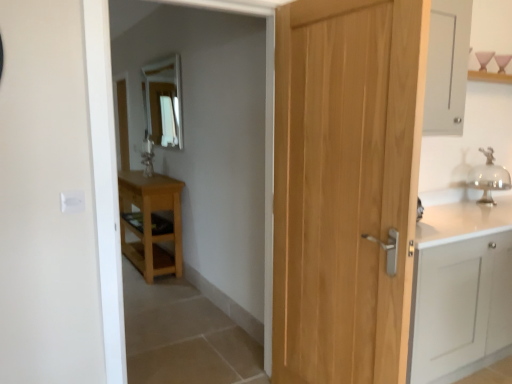
Locate an element on the screen. The height and width of the screenshot is (384, 512). clear glass mirror at upper center is located at coordinates (164, 102).

At what (x,y) coordinates should I click in order to perform the action: click on clear glass bell at right. Please return your answer as a coordinate pair (x, y). The image size is (512, 384). Looking at the image, I should click on (489, 177).

Image resolution: width=512 pixels, height=384 pixels. In order to click on clear glass mirror at upper center in this screenshot , I will do `click(164, 102)`.

You are a GUI agent. You are given a task and a screenshot of the screen. Output one action in this format:
    pyautogui.click(x=<x>, y=<y>)
    Task: Click on the faucet above the light brown wood door at center (from a real-world perspective)
    
    Given the screenshot: What is the action you would take?
    pyautogui.click(x=489, y=177)

Is light brown wood door at center inside clear glass bell at right?

Actually, light brown wood door at center is outside clear glass bell at right.

Consider the image. Is clear glass bell at right in contact with light brown wood door at center?

No, clear glass bell at right is not in contact with light brown wood door at center.

From a real-world perspective, is clear glass bell at right physically located above or below light brown wood door at center?

From a real-world perspective, clear glass bell at right is physically above light brown wood door at center.

Would you say clear glass mirror at upper center contains clear glass bell at right?

Definitely not — clear glass bell at right is not inside clear glass mirror at upper center.

From the image's perspective, which one is positioned higher, clear glass mirror at upper center or clear glass bell at right?

clear glass mirror at upper center, from the image's perspective.

At what (x,y) coordinates should I click in order to perform the action: click on mirror located above the clear glass bell at right (from a real-world perspective). Please return your answer as a coordinate pair (x, y). Looking at the image, I should click on (164, 102).

From the image's perspective, relative to light brown wood door at center, is light wood table at left above or below?

From the image's perspective, light wood table at left appears below light brown wood door at center.

Can you confirm if light wood table at left is thinner than light brown wood door at center?

In fact, light wood table at left might be wider than light brown wood door at center.

In the scene shown: Considering their positions, is light wood table at left located in front of or behind light brown wood door at center?

Visually, light wood table at left is located behind light brown wood door at center.

From a real-world perspective, which is physically above, light brown wood door at center or clear glass bell at right?

clear glass bell at right is physically above.

Does light brown wood door at center appear on the right side of clear glass bell at right?

Incorrect, light brown wood door at center is not on the right side of clear glass bell at right.

Is light brown wood door at center not within clear glass bell at right?

Indeed, light brown wood door at center is completely outside clear glass bell at right.

Does light brown wood door at center have a greater width compared to clear glass bell at right?

No.

From the image's perspective, is light wood table at left located above clear glass mirror at upper center?

No, from the image's perspective, light wood table at left is not over clear glass mirror at upper center.

From a real-world perspective, is light wood table at left beneath clear glass mirror at upper center?

Yes, from a real-world perspective, light wood table at left is beneath clear glass mirror at upper center.

Is point (159, 231) positioned behind point (164, 93)?

That is True.

Is light wood table at left situated inside clear glass bell at right or outside?

light wood table at left lies outside clear glass bell at right.

In the scene shown: Which is more to the left, light wood table at left or clear glass bell at right?

Positioned to the left is light wood table at left.

Is light wood table at left bigger than clear glass bell at right?

Indeed, light wood table at left has a larger size compared to clear glass bell at right.

Identify the location of table below the clear glass bell at right (from a real-world perspective). The height and width of the screenshot is (384, 512). (151, 222).

Could you tell me if light brown wood door at center is turned towards clear glass mirror at upper center?

No, light brown wood door at center is not facing towards clear glass mirror at upper center.

Identify the location of mirror above the light brown wood door at center (from a real-world perspective). (164, 102).

In the scene shown: Can you tell me how much light brown wood door at center and clear glass mirror at upper center differ in facing direction?

The angle between the facing direction of light brown wood door at center and the facing direction of clear glass mirror at upper center is 0.493 degrees.

Which is closer to the camera, [333,352] or [172,98]?

Point [333,352] is positioned closer to the camera compared to point [172,98].

At what (x,y) coordinates should I click in order to perform the action: click on door in front of the clear glass bell at right. Please return your answer as a coordinate pair (x, y). This screenshot has height=384, width=512. Looking at the image, I should click on (346, 187).

This screenshot has height=384, width=512. Identify the location of mirror above the clear glass bell at right (from a real-world perspective). (164, 102).

Considering their positions, is clear glass mirror at upper center positioned closer to light brown wood door at center than clear glass bell at right?

Based on the image, clear glass bell at right appears to be nearer to light brown wood door at center.

From the image, which object appears to be farther from clear glass mirror at upper center, light brown wood door at center or light wood table at left?

light brown wood door at center lies further to clear glass mirror at upper center than the other object.

When comparing their distances from light wood table at left, does light brown wood door at center or clear glass bell at right seem closer?

Among the two, light brown wood door at center is located nearer to light wood table at left.

Which object lies nearer to the anchor point clear glass bell at right, light wood table at left or light brown wood door at center?

light brown wood door at center.

Considering their positions, is light wood table at left positioned further to light brown wood door at center than clear glass bell at right?

light wood table at left.

Estimate the real-world distances between objects in this image. Which object is further from clear glass mirror at upper center, clear glass bell at right or light wood table at left?

clear glass bell at right lies further to clear glass mirror at upper center than the other object.

Which object lies further to the anchor point light brown wood door at center, clear glass bell at right or clear glass mirror at upper center?

Among the two, clear glass mirror at upper center is located further to light brown wood door at center.

Estimate the real-world distances between objects in this image. Which object is closer to light wood table at left, clear glass mirror at upper center or clear glass bell at right?

clear glass mirror at upper center lies closer to light wood table at left than the other object.

The width and height of the screenshot is (512, 384). In order to click on table between light brown wood door at center and clear glass mirror at upper center in the front-back direction in this screenshot , I will do `click(151, 222)`.

The image size is (512, 384). In order to click on mirror located between light wood table at left and clear glass bell at right in the left-right direction in this screenshot , I will do `click(164, 102)`.

Where is `door between light wood table at left and clear glass bell at right from left to right`? The height and width of the screenshot is (384, 512). door between light wood table at left and clear glass bell at right from left to right is located at coordinates (346, 187).

Find the location of a particular element. Image resolution: width=512 pixels, height=384 pixels. door located between clear glass mirror at upper center and clear glass bell at right in the left-right direction is located at coordinates (346, 187).